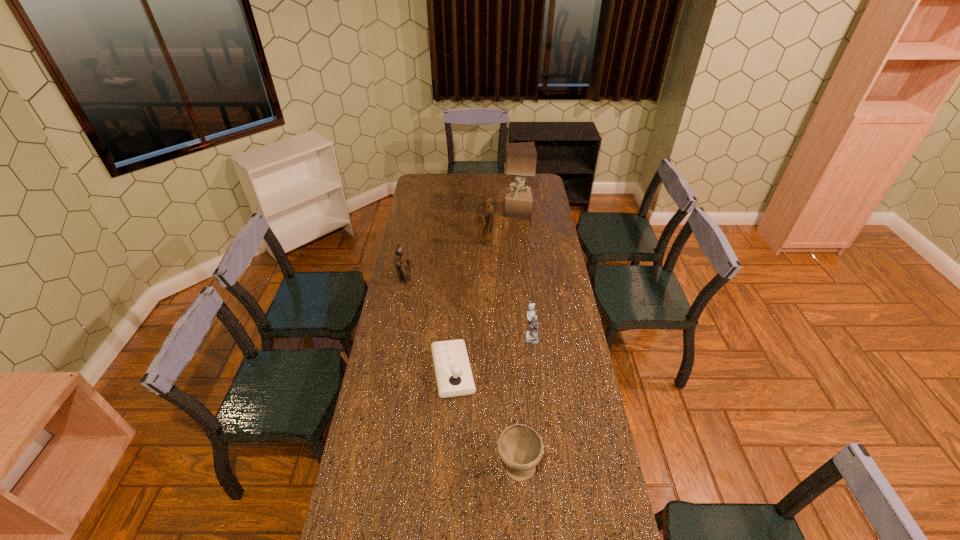
Locate an element on the screen. vacant area that lies between the tallest figurine and the second shortest object is located at coordinates (501, 356).

Identify the location of free space between the nearest figurine and the farthest object. This screenshot has height=540, width=960. (523, 275).

Identify the location of free space between the fifth object from right to left and the tallest object. This screenshot has width=960, height=540. (485, 292).

The height and width of the screenshot is (540, 960). I want to click on free point between the rightmost figurine and the fourth nearest object, so click(x=468, y=309).

Find the location of a particular element. The image size is (960, 540). free spot between the rightmost figurine and the fourth nearest object is located at coordinates (468, 309).

Identify the location of empty space between the shortest object and the second farthest figurine. The image size is (960, 540). (430, 326).

Find the location of a particular element. Image resolution: width=960 pixels, height=540 pixels. object that is the closest to the fourth farthest object is located at coordinates (454, 377).

At what (x,y) coordinates should I click in order to perform the action: click on the fourth closest object to the second nearest object. Please return your answer as a coordinate pair (x, y). The image size is (960, 540). Looking at the image, I should click on (485, 212).

Point out which figurine is positioned as the nearest to the farthest figurine. Please provide its 2D coordinates. Your answer should be formatted as a tuple, i.e. [(x, y)], where the tuple contains the x and y coordinates of a point satisfying the conditions above.

[(401, 260)]

You are a GUI agent. You are given a task and a screenshot of the screen. Output one action in this format:
    pyautogui.click(x=<x>, y=<y>)
    Task: Click on the figurine that is the second closest to the farthest object
    The width and height of the screenshot is (960, 540).
    Given the screenshot: What is the action you would take?
    pyautogui.click(x=401, y=260)